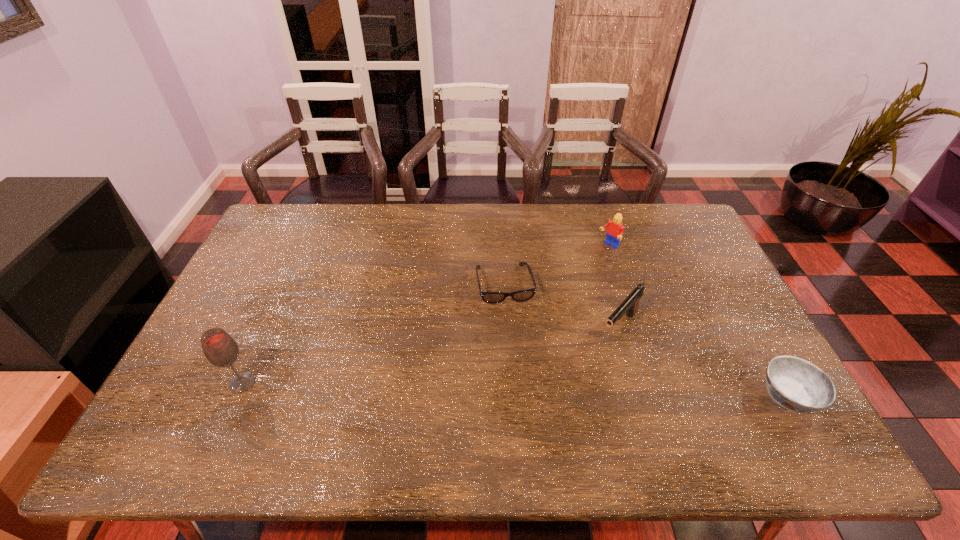
The image size is (960, 540). I want to click on free space on the desktop that is between the glass drink container and the rightmost object and is positioned on the lenses of the second object from left to right, so click(x=525, y=389).

Identify the location of free spot on the desktop that is between the tallest object and the rightmost object and is positioned on the front-facing side of the Lego. This screenshot has height=540, width=960. (443, 388).

Locate an element on the screen. The image size is (960, 540). vacant space on the desktop that is between the glass drink container and the rightmost object and is positioned at the muzzle of the pistol is located at coordinates (565, 390).